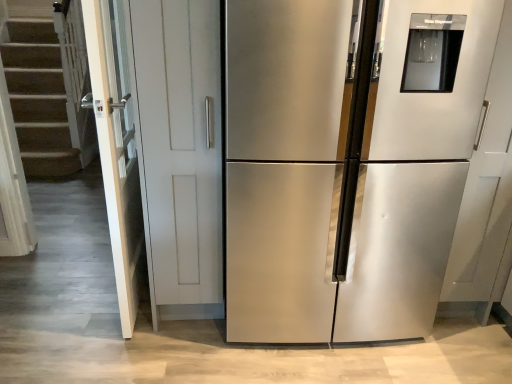
Question: Does white glossy door at left have a lesser height compared to stainless steel refrigerator at center?

Choices:
 (A) no
 (B) yes

Answer: (B)

Question: Is stainless steel refrigerator at center a part of white glossy door at left?

Choices:
 (A) yes
 (B) no

Answer: (B)

Question: From a real-world perspective, is white glossy door at left under stainless steel refrigerator at center?

Choices:
 (A) yes
 (B) no

Answer: (A)

Question: Does white glossy door at left come in front of stainless steel refrigerator at center?

Choices:
 (A) no
 (B) yes

Answer: (A)

Question: Does white glossy door at left appear on the left side of stainless steel refrigerator at center?

Choices:
 (A) no
 (B) yes

Answer: (B)

Question: Can you confirm if white glossy door at left is positioned to the right of stainless steel refrigerator at center?

Choices:
 (A) yes
 (B) no

Answer: (B)

Question: Considering the relative positions of stainless steel refrigerator at center and white glossy door at left in the image provided, is stainless steel refrigerator at center to the right of white glossy door at left from the viewer's perspective?

Choices:
 (A) yes
 (B) no

Answer: (A)

Question: Could you tell me if stainless steel refrigerator at center is facing white glossy door at left?

Choices:
 (A) yes
 (B) no

Answer: (B)

Question: Does stainless steel refrigerator at center have a smaller size compared to white glossy door at left?

Choices:
 (A) yes
 (B) no

Answer: (B)

Question: Is stainless steel refrigerator at center shorter than white glossy door at left?

Choices:
 (A) yes
 (B) no

Answer: (B)

Question: Does stainless steel refrigerator at center have a greater width compared to white glossy door at left?

Choices:
 (A) yes
 (B) no

Answer: (A)

Question: From a real-world perspective, is stainless steel refrigerator at center on white glossy door at left?

Choices:
 (A) yes
 (B) no

Answer: (A)

Question: Is stainless steel refrigerator at center wider or thinner than white glossy door at left?

Choices:
 (A) thin
 (B) wide

Answer: (B)